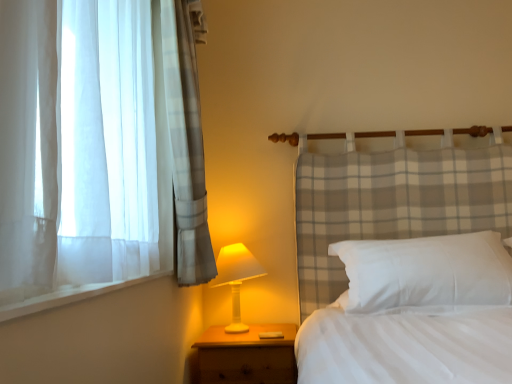
The height and width of the screenshot is (384, 512). Describe the element at coordinates (236, 278) in the screenshot. I see `white plastic table lamp at lower center` at that location.

Identify the location of white plastic table lamp at lower center. (236, 278).

Locate an element on the screen. This screenshot has width=512, height=384. wooden nightstand at lower left is located at coordinates (246, 356).

Does white plastic table lamp at lower center come behind white soft pillow at center?

Yes, the depth of white plastic table lamp at lower center is greater than that of white soft pillow at center.

Does white plastic table lamp at lower center have a smaller size compared to white soft pillow at center?

Yes.

Which point is more forward, (250, 252) or (468, 289)?

The point (468, 289) is more forward.

Is white plastic table lamp at lower center far from white soft pillow at center?

No, white plastic table lamp at lower center is not far away from white soft pillow at center.

Considering the sizes of objects white plastic table lamp at lower center and wooden nightstand at lower left in the image provided, who is thinner, white plastic table lamp at lower center or wooden nightstand at lower left?

Thinner between the two is white plastic table lamp at lower center.

Is white plastic table lamp at lower center far away from wooden nightstand at lower left?

No, white plastic table lamp at lower center is not far away from wooden nightstand at lower left.

Is point (224, 280) positioned after point (243, 380)?

Yes, point (224, 280) is farther from viewer.

Based on their positions, is white plastic table lamp at lower center located to the left or right of wooden nightstand at lower left?

From the image, it's evident that white plastic table lamp at lower center is to the left of wooden nightstand at lower left.

Considering the sizes of wooden nightstand at lower left and white plastic table lamp at lower center in the image, is wooden nightstand at lower left wider or thinner than white plastic table lamp at lower center?

Considering their sizes, wooden nightstand at lower left looks broader than white plastic table lamp at lower center.

From a real-world perspective, who is located lower, wooden nightstand at lower left or white plastic table lamp at lower center?

From a 3D spatial view, wooden nightstand at lower left is below.

Is wooden nightstand at lower left aimed at white plastic table lamp at lower center?

No, wooden nightstand at lower left does not turn towards white plastic table lamp at lower center.

Based on the photo, from the image's perspective, does wooden nightstand at lower left appear lower than white plastic table lamp at lower center?

Yes, from the image's perspective, wooden nightstand at lower left is below white plastic table lamp at lower center.

Which is closer to the camera, (476,301) or (238,383)?

Point (476,301)

From the image's perspective, is white soft pillow at center located above or below wooden nightstand at lower left?

Based on their image positions, white soft pillow at center is located above wooden nightstand at lower left.

Which object is further away from the camera taking this photo, white soft pillow at center or wooden nightstand at lower left?

wooden nightstand at lower left is more distant.

At what (x,y) coordinates should I click in order to perform the action: click on pillow in front of the wooden nightstand at lower left. Please return your answer as a coordinate pair (x, y). This screenshot has height=384, width=512. Looking at the image, I should click on (425, 272).

Is wooden nightstand at lower left facing away from white soft pillow at center?

No, wooden nightstand at lower left is not facing the opposite direction of white soft pillow at center.

In the scene shown: Is wooden nightstand at lower left next to white soft pillow at center and touching it?

They are not placed beside each other.

Would you say wooden nightstand at lower left is inside or outside white soft pillow at center?

wooden nightstand at lower left is not enclosed by white soft pillow at center.

Can you tell me how much white soft pillow at center and white plastic table lamp at lower center differ in facing direction?

The angle between the facing direction of white soft pillow at center and the facing direction of white plastic table lamp at lower center is 0.202 degrees.

Based on their sizes in the image, would you say white soft pillow at center is bigger or smaller than white plastic table lamp at lower center?

Considering their sizes, white soft pillow at center takes up more space than white plastic table lamp at lower center.

Where is `table lamp lying below the white soft pillow at center (from the image's perspective)`? table lamp lying below the white soft pillow at center (from the image's perspective) is located at coordinates (236, 278).

Is white soft pillow at center facing away from white plastic table lamp at lower center?

No, white soft pillow at center is not facing away from white plastic table lamp at lower center.

Image resolution: width=512 pixels, height=384 pixels. What are the coordinates of `pillow that appears above the white plastic table lamp at lower center (from the image's perspective)` in the screenshot? It's located at (425, 272).

Identify the location of nightstand located in front of the white plastic table lamp at lower center. The width and height of the screenshot is (512, 384). (246, 356).

When comparing their distances from white plastic table lamp at lower center, does wooden nightstand at lower left or white soft pillow at center seem further?

white soft pillow at center is further to white plastic table lamp at lower center.

Considering their positions, is wooden nightstand at lower left positioned closer to white soft pillow at center than white plastic table lamp at lower center?

wooden nightstand at lower left is positioned closer to the anchor white soft pillow at center.

Which object lies further to the anchor point white soft pillow at center, white plastic table lamp at lower center or wooden nightstand at lower left?

white plastic table lamp at lower center lies further to white soft pillow at center than the other object.

Looking at this image, from the image, which object appears to be farther from wooden nightstand at lower left, white soft pillow at center or white plastic table lamp at lower center?

white soft pillow at center lies further to wooden nightstand at lower left than the other object.

From the picture: From the image, which object appears to be farther from white plastic table lamp at lower center, white soft pillow at center or wooden nightstand at lower left?

The object further to white plastic table lamp at lower center is white soft pillow at center.

Based on their spatial positions, is white plastic table lamp at lower center or white soft pillow at center further from wooden nightstand at lower left?

white soft pillow at center is positioned further to the anchor wooden nightstand at lower left.

Find the location of a particular element. Image resolution: width=512 pixels, height=384 pixels. nightstand situated between white plastic table lamp at lower center and white soft pillow at center from left to right is located at coordinates (246, 356).